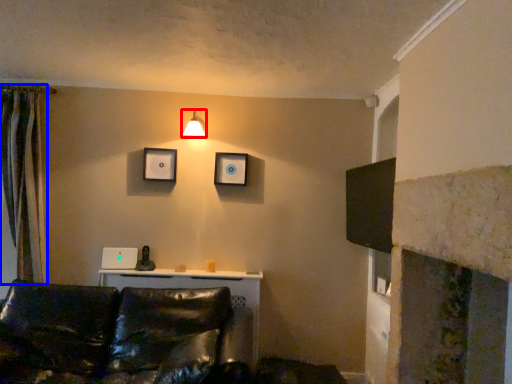
Question: Which point is closer to the camera, light fixture (highlighted by a red box) or curtain (highlighted by a blue box)?

Choices:
 (A) light fixture
 (B) curtain

Answer: (B)